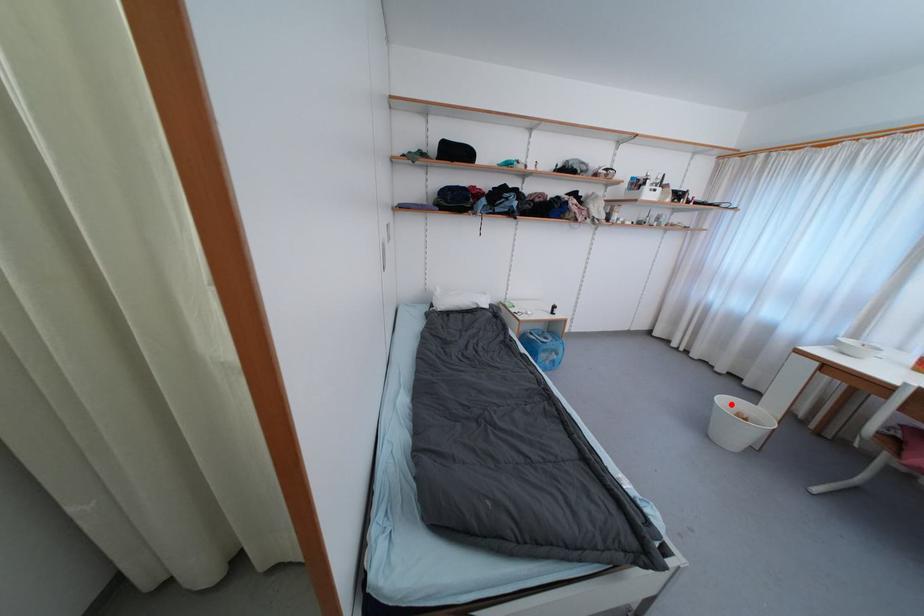
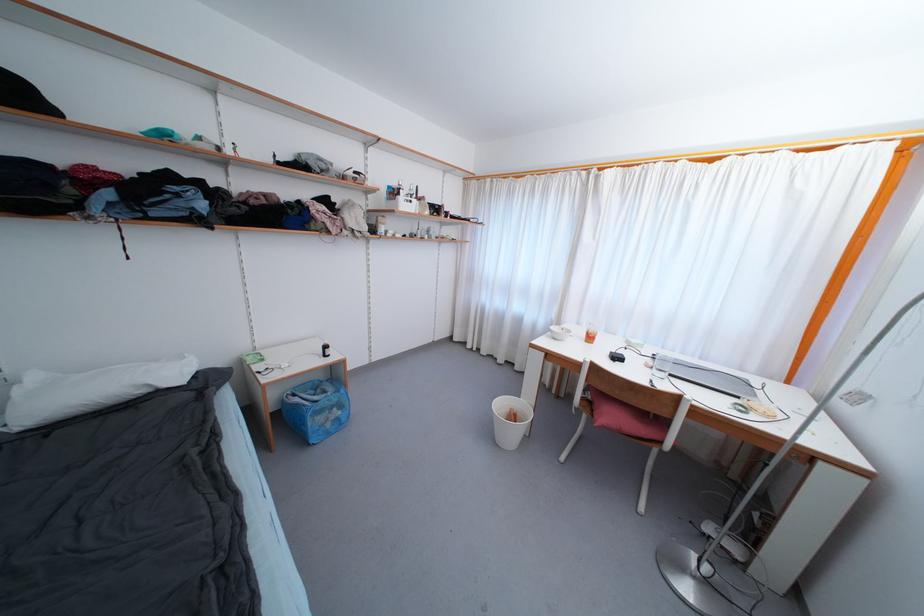
The point at the highlighted location is marked in the first image. Where is the corresponding point in the second image?

(505, 407)